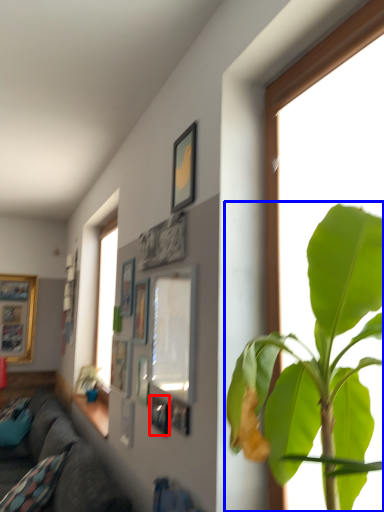
Question: Which object appears closest to the camera in this image, picture frame (highlighted by a red box) or houseplant (highlighted by a blue box)?

Choices:
 (A) picture frame
 (B) houseplant

Answer: (B)